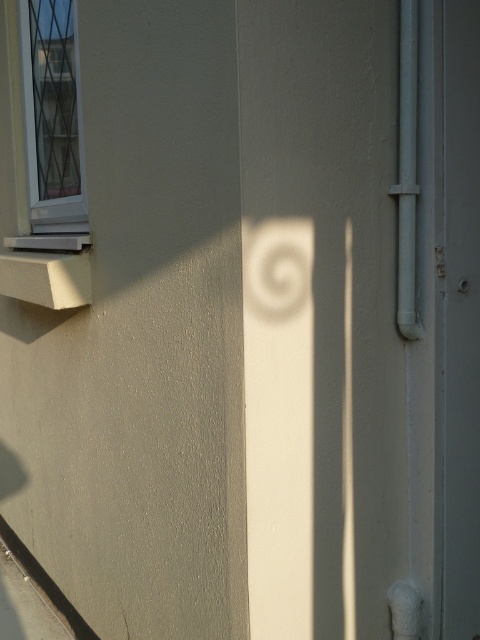
Question: Is white plastic window at upper left closer to camera compared to smooth gray pipe at right?

Choices:
 (A) yes
 (B) no

Answer: (B)

Question: Among these points, which one is farthest from the camera?

Choices:
 (A) (412, 625)
 (B) (400, 132)

Answer: (A)

Question: Which point is closer to the camera taking this photo?

Choices:
 (A) (408, 115)
 (B) (396, 621)

Answer: (A)

Question: Which object appears farthest from the camera in this image?

Choices:
 (A) smooth gray pipe at right
 (B) white plastic window at upper left
 (C) white matte plaster bandage at lower right

Answer: (B)

Question: Can you confirm if white plastic window at upper left is positioned to the left of smooth gray pipe at right?

Choices:
 (A) yes
 (B) no

Answer: (A)

Question: Is smooth gray pipe at right further to the viewer compared to white matte plaster bandage at lower right?

Choices:
 (A) no
 (B) yes

Answer: (A)